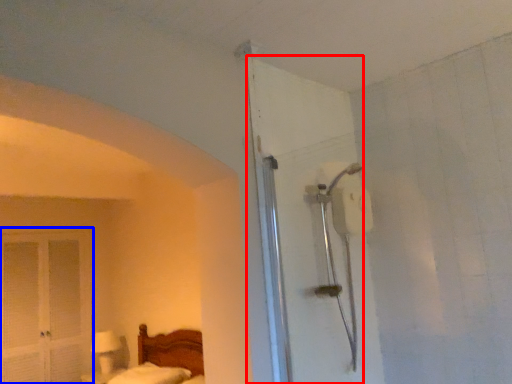
Question: Which object is further to the camera taking this photo, door (highlighted by a red box) or screen door (highlighted by a blue box)?

Choices:
 (A) door
 (B) screen door

Answer: (B)